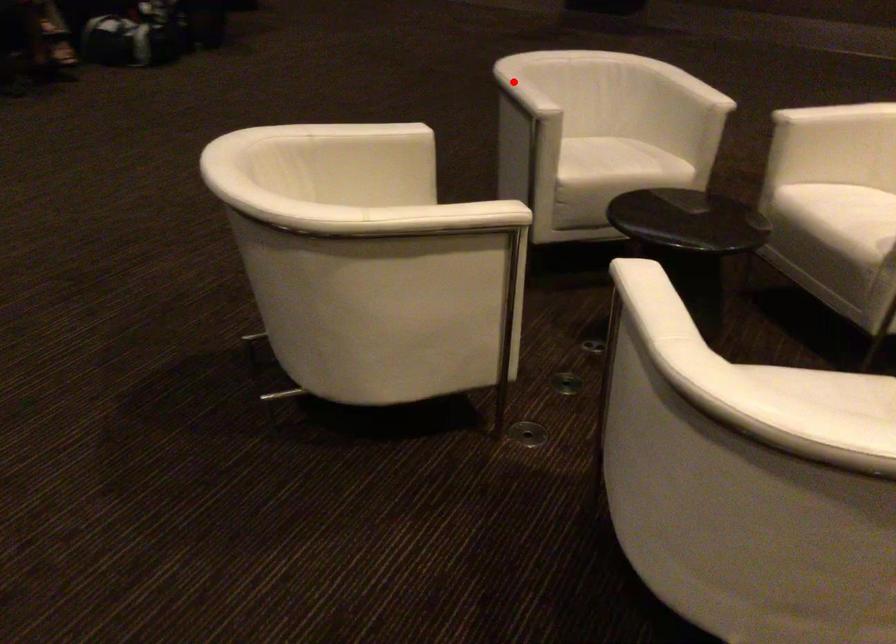
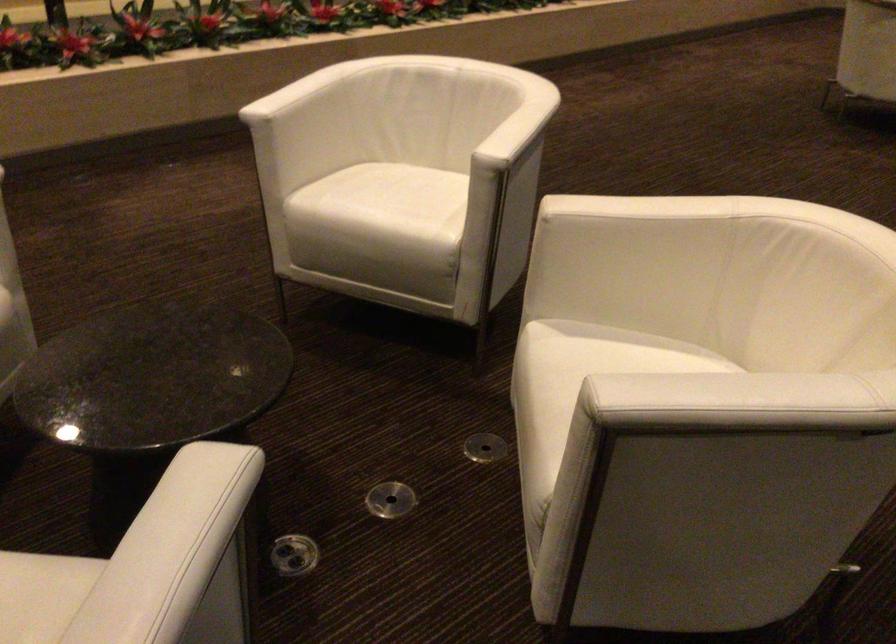
Question: I am providing you with two images of the same scene from different viewpoints. Given a red point in image1, look at the same physical point in image2. Is it:

Choices:
 (A) Closer to the viewpoint
 (B) Farther from the viewpoint

Answer: (A)